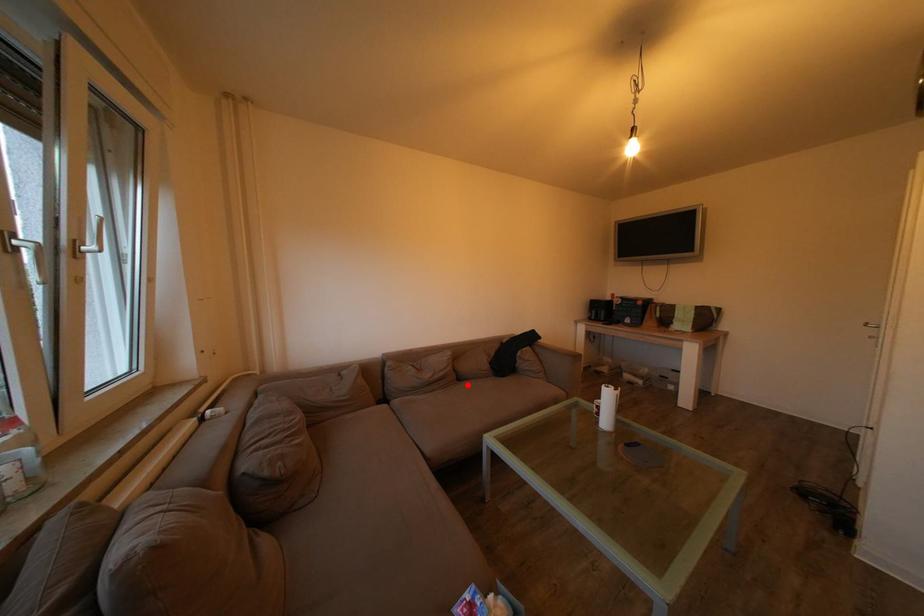
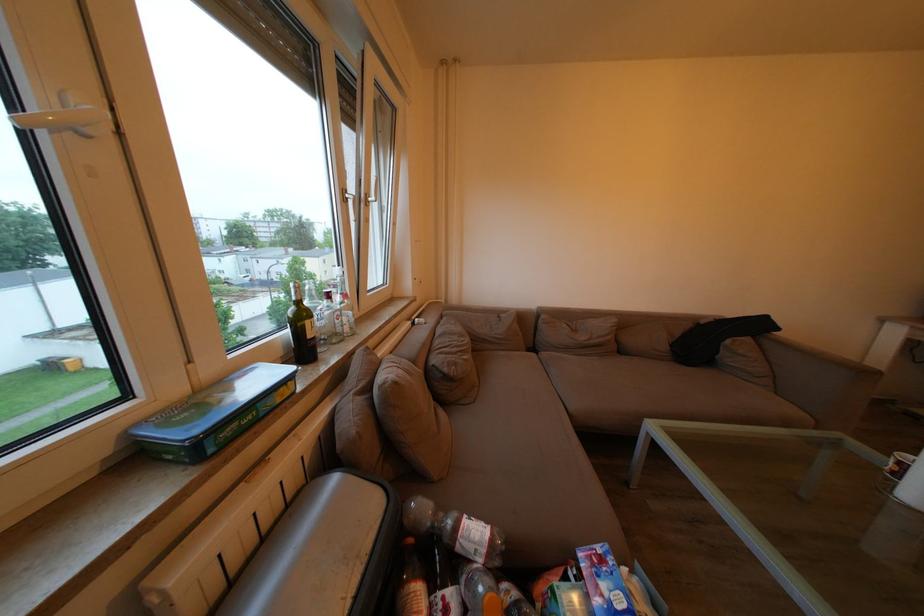
Where in the second image is the point corresponding to the highlighted location from the first image?

(629, 358)